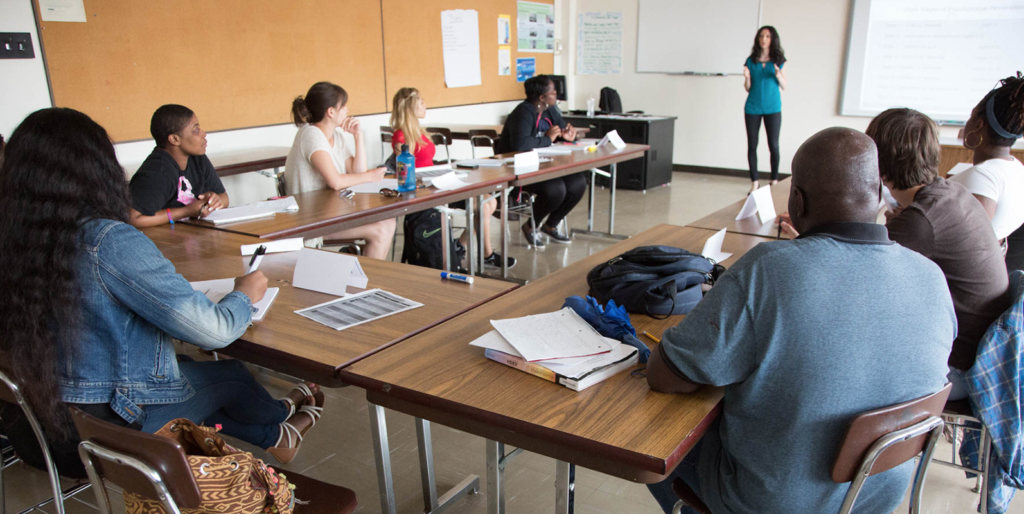
The height and width of the screenshot is (514, 1024). In order to click on tabletops in this screenshot , I will do `click(556, 160)`, `click(464, 174)`, `click(156, 242)`, `click(449, 361)`, `click(727, 219)`.